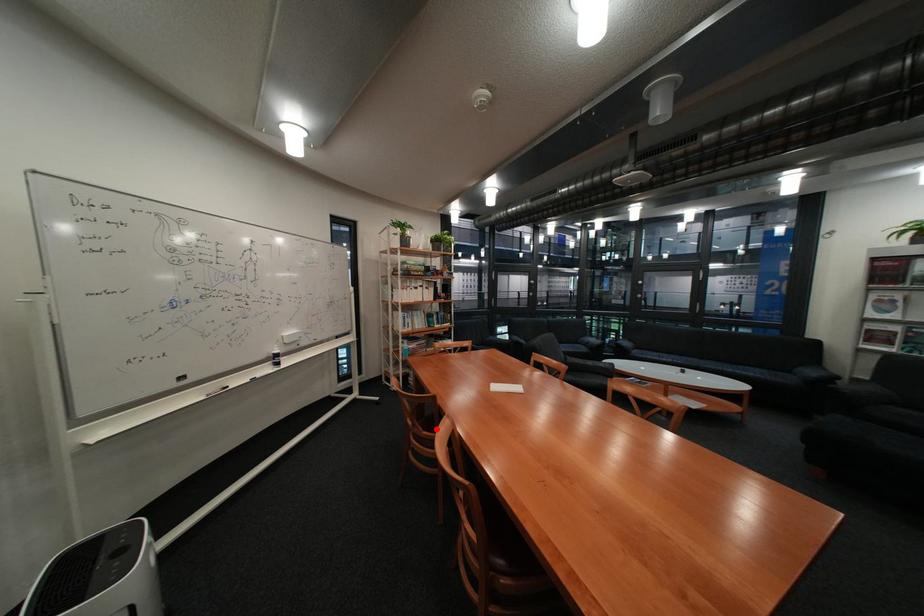
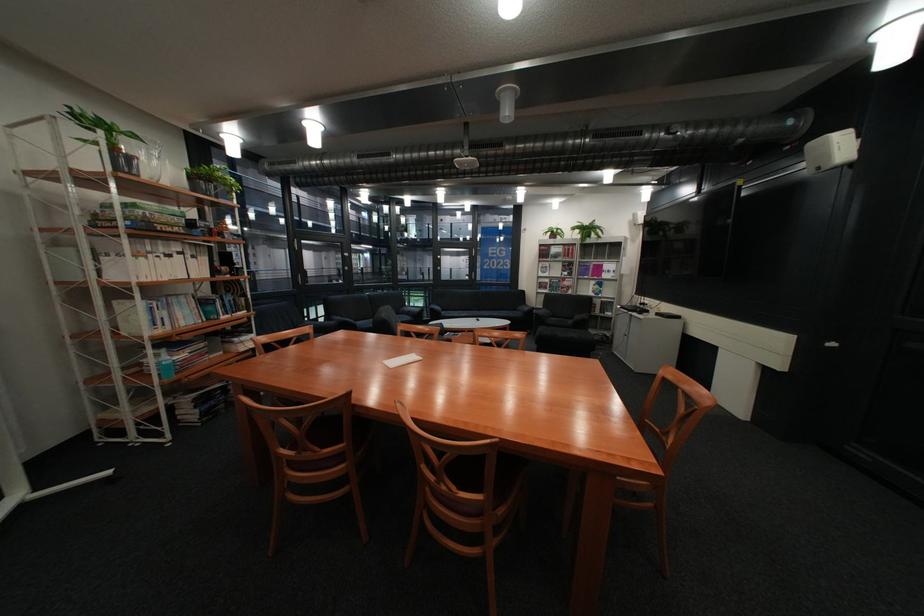
Question: I am providing you with two images of the same scene from different viewpoints. A red point is shown in image1. For the corresponding object point in image2, is it positioned nearer or farther from the camera?

Choices:
 (A) Nearer
 (B) Farther

Answer: (A)